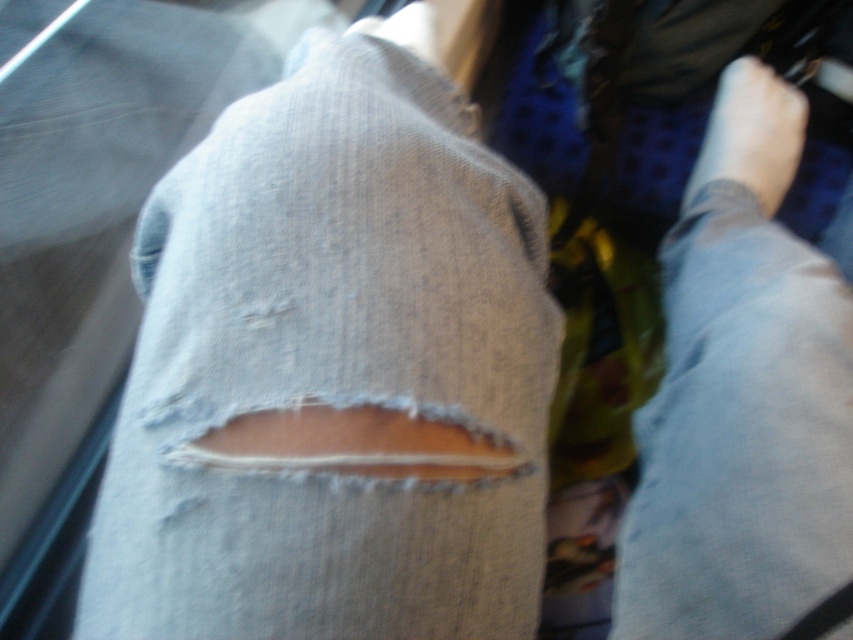
You are sitting on a train and want to place a small bag between the two points marked as point (653, 483) and point (770, 148). Can you tell me which point is closer to you so you can place the bag there?

Point (653, 483) is in front of point (770, 148), so the point closer to you is point (653, 483). Place the bag near that point.

Consider the image. You are a tailor trying to repair the light blue denim jeans at lower right and the white smooth foot at upper right. Which item requires more fabric for the repair?

The light blue denim jeans at lower right requires more fabric for the repair since it is larger in size than the white smooth foot at upper right.

You are a fashion designer analyzing the placement of a denim tear in an outfit. The light blue denim jeans at lower right have a tear. Where exactly is the tear located on the jeans?

The tear on the light blue denim jeans at lower right is located at point coordinates of (x=741, y=429).